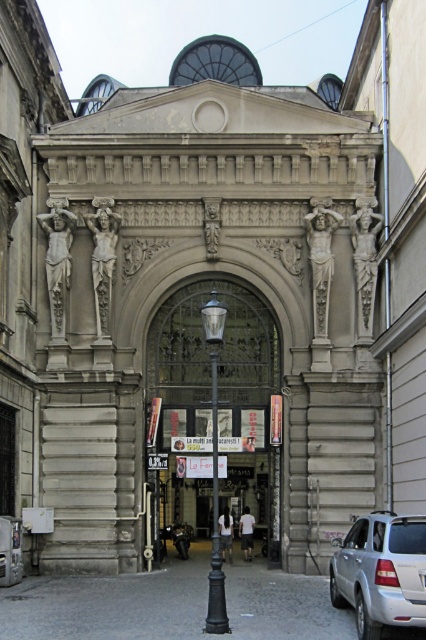
Who is taller, silver metallic car at center or sculpted stone figure at center?

With more height is silver metallic car at center.

Does silver metallic car at center appear on the left side of sculpted stone figure at center?

Incorrect, silver metallic car at center is not on the left side of sculpted stone figure at center.

Is point (388, 593) closer to camera compared to point (328, 291)?

That is True.

The height and width of the screenshot is (640, 426). Identify the location of silver metallic car at center. (380, 572).

Who is taller, silver metallic car at center or matte stone statue at center?

silver metallic car at center is taller.

Between silver metallic car at center and matte stone statue at center, which one appears on the right side from the viewer's perspective?

silver metallic car at center is more to the right.

Describe the element at coordinates (380, 572) in the screenshot. I see `silver metallic car at center` at that location.

Where is `silver metallic car at center`? silver metallic car at center is located at coordinates (380, 572).

Which is in front, point (319, 253) or point (95, 323)?

Point (319, 253) is in front.

Which is more to the right, sculpted stone figure at center or polished stone statue at center?

sculpted stone figure at center

Does point (313, 294) come in front of point (111, 268)?

Yes.

The width and height of the screenshot is (426, 640). I want to click on sculpted stone figure at center, so click(321, 259).